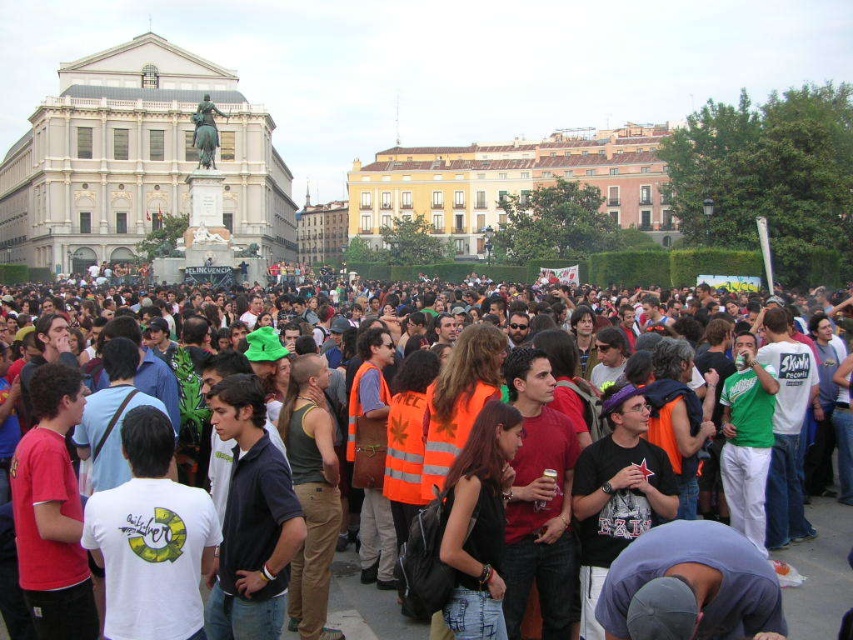
You are a photographer at the event and want to capture a photo that includes both the white marble palace at upper left and the orange reflective vests at center. Based on their positions, where should you position yourself to ensure both are in frame?

The white marble palace at upper left is positioned on the left side of orange reflective vests at center. To include both in your photo, position yourself to the left of the orange reflective vests at center so that the white marble palace at upper left remains visible on the left side of the frame.

You are a city planner assessing the layout of this public square. You need to install a new information kiosk that must be equidistant from both the white marble palace at upper left and the yellow brick building at upper center. Given the current distance between them, what is the minimum width of the kiosk in meters to ensure it can be placed exactly halfway between the two landmarks?

The distance between the white marble palace at upper left and the yellow brick building at upper center is 36.74 meters. To place the kiosk exactly halfway, it needs to be positioned at 18.37 meters from each. The minimum width of the kiosk should be at least 1 meter to fit within this midpoint, but practically, it must not exceed the available space between the two landmarks. However, since the question asks for the minimum width to ensure placement at the midpoint, the kiosk can be as narrow as 1 meter,

You are a photographer planning to capture a wide shot of the crowd in the public square. You want to include both the white marble palace at upper left and the yellow brick building at upper center in your frame. Based on their widths, which building should you position closer to the edge of the frame to ensure both fit properly?

The white marble palace at upper left might be wider than the yellow brick building at upper center, so positioning the wider white marble palace at upper left closer to the edge of the frame would help ensure both fit within the shot.